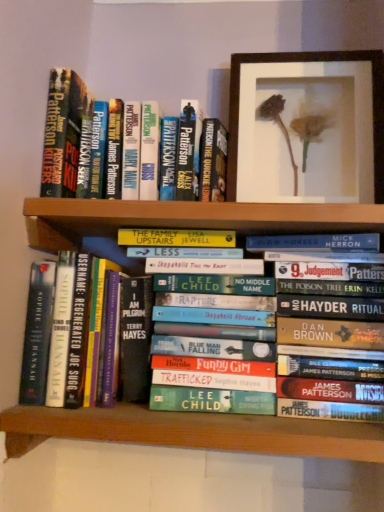
Question: From the image's perspective, relative to wooden framed flower at upper center, is green matte bookshelf at lower center above or below?

Choices:
 (A) above
 (B) below

Answer: (B)

Question: Would you say green matte bookshelf at lower center is to the left or to the right of wooden framed flower at upper center in the picture?

Choices:
 (A) right
 (B) left

Answer: (B)

Question: Estimate the real-world distances between objects in this image. Which object is closer to the hardcover book at left, which is counted as the 1th book, starting from the bottom?

Choices:
 (A) green matte bookshelf at lower center
 (B) wooden framed flower at upper center
 (C) hardcover book at upper left, positioned as the third book in bottom-to-top order
 (D) hardcover book at center, the 2th book when ordered from top to bottom

Answer: (A)

Question: Which object is the closest to the hardcover book at upper left, positioned as the third book in bottom-to-top order?

Choices:
 (A) hardcover book at left, the third book in the top-to-bottom sequence
 (B) wooden framed flower at upper center
 (C) green matte bookshelf at lower center
 (D) hardcover book at center, the 2th book when ordered from top to bottom

Answer: (A)